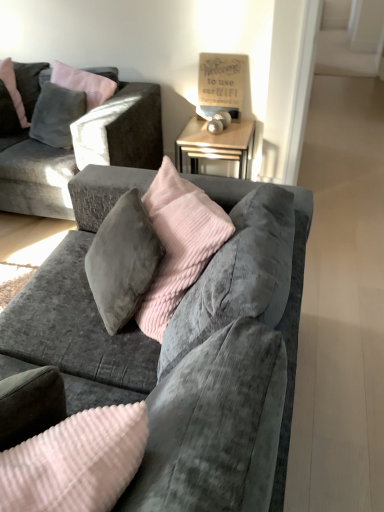
Image resolution: width=384 pixels, height=512 pixels. What do you see at coordinates (78, 146) in the screenshot? I see `velvet gray couch at upper left, which is the 1th studio couch in back-to-front order` at bounding box center [78, 146].

What do you see at coordinates (94, 364) in the screenshot?
I see `velvet gray couch at center, which is counted as the second studio couch, starting from the back` at bounding box center [94, 364].

At what (x,y) coordinates should I click in order to perform the action: click on matte gray pillow at upper left. Please return your answer as a coordinate pair (x, y). Looking at the image, I should click on (13, 89).

From their relative heights in the image, would you say matte gray pillow at upper left is taller or shorter than velvet gray couch at upper left, which ranks as the second studio couch in front-to-back order?

In the image, matte gray pillow at upper left appears to be shorter than velvet gray couch at upper left, which ranks as the second studio couch in front-to-back order.

From a real-world perspective, is matte gray pillow at upper left located beneath velvet gray couch at upper left, which is the 1th studio couch in back-to-front order?

No.

Which object is positioned more to the left, matte gray pillow at upper left or velvet gray couch at upper left, positioned as the 2th studio couch in bottom-to-top order?

From the viewer's perspective, matte gray pillow at upper left appears more on the left side.

Between matte gray pillow at upper left and velvet gray couch at upper left, the 1th studio couch from the top, which one is positioned behind?

matte gray pillow at upper left.

Between velvet gray couch at center, which is counted as the second studio couch, starting from the back, and matte gray pillow at upper left, which one is positioned behind?

matte gray pillow at upper left is further from the camera.

Considering the points (274, 507) and (12, 95), which point is behind, point (274, 507) or point (12, 95)?

The point (12, 95) is farther.

From a real-world perspective, starting from the matte gray pillow at upper left, which studio couch is the 2nd one below it? Please provide its 2D coordinates.

[(94, 364)]

Considering the relative sizes of velvet gray couch at center, placed as the first studio couch when sorted from bottom to top, and matte gray pillow at upper left in the image provided, is velvet gray couch at center, placed as the first studio couch when sorted from bottom to top, taller than matte gray pillow at upper left?

Yes.

Does point (114, 111) come behind point (14, 106)?

No, it is not.

Could matte gray pillow at upper left be considered to be inside velvet gray couch at upper left, the 1th studio couch from the top?

Yes, matte gray pillow at upper left is surrounded by velvet gray couch at upper left, the 1th studio couch from the top.

Who is taller, velvet gray couch at upper left, positioned as the 2th studio couch in bottom-to-top order, or matte gray pillow at upper left?

velvet gray couch at upper left, positioned as the 2th studio couch in bottom-to-top order.

From a real-world perspective, is velvet gray couch at upper left, which is the 1th studio couch in back-to-front order, positioned under velvet gray couch at center, which is counted as the second studio couch, starting from the back, based on gravity?

No, from a real-world perspective, velvet gray couch at upper left, which is the 1th studio couch in back-to-front order, is not below velvet gray couch at center, which is counted as the second studio couch, starting from the back.

Is velvet gray couch at upper left, which ranks as the second studio couch in front-to-back order, completely or partially outside of velvet gray couch at center, the 2th studio couch from the top?

velvet gray couch at upper left, which ranks as the second studio couch in front-to-back order, lies outside velvet gray couch at center, the 2th studio couch from the top,'s area.

Could you tell me if velvet gray couch at upper left, which is the 1th studio couch in back-to-front order, is facing velvet gray couch at center, which is counted as the second studio couch, starting from the back?

No.

Which of these two, velvet gray couch at upper left, the 1th studio couch from the top, or velvet gray couch at center, the 2th studio couch from the top, is thinner?

velvet gray couch at upper left, the 1th studio couch from the top, is thinner.

Is velvet gray couch at center, the 2th studio couch from the top, positioned with its back to velvet gray couch at upper left, the 1th studio couch from the top?

That's not correct — velvet gray couch at center, the 2th studio couch from the top, is not looking away from velvet gray couch at upper left, the 1th studio couch from the top.

How much distance is there between velvet gray couch at center, the 2th studio couch from the top, and velvet gray couch at upper left, the 1th studio couch from the top?

A distance of 37.45 inches exists between velvet gray couch at center, the 2th studio couch from the top, and velvet gray couch at upper left, the 1th studio couch from the top.

From the image's perspective, is velvet gray couch at center, which appears as the first studio couch when viewed from the front, above or below velvet gray couch at upper left, which is the 1th studio couch in back-to-front order?

velvet gray couch at center, which appears as the first studio couch when viewed from the front, is situated lower than velvet gray couch at upper left, which is the 1th studio couch in back-to-front order, in the image.

From their relative heights in the image, would you say velvet gray couch at center, which is counted as the second studio couch, starting from the back, is taller or shorter than velvet gray couch at upper left, which is the 1th studio couch in back-to-front order?

In the image, velvet gray couch at center, which is counted as the second studio couch, starting from the back, appears to be shorter than velvet gray couch at upper left, which is the 1th studio couch in back-to-front order.

Based on their sizes in the image, would you say matte gray pillow at upper left is bigger or smaller than velvet gray couch at center, which is counted as the second studio couch, starting from the back?

matte gray pillow at upper left is smaller than velvet gray couch at center, which is counted as the second studio couch, starting from the back.

Can you confirm if matte gray pillow at upper left is taller than velvet gray couch at center, the 2th studio couch from the top?

Incorrect, the height of matte gray pillow at upper left is not larger of that of velvet gray couch at center, the 2th studio couch from the top.

Considering the relative sizes of matte gray pillow at upper left and velvet gray couch at center, placed as the first studio couch when sorted from bottom to top, in the image provided, is matte gray pillow at upper left wider than velvet gray couch at center, placed as the first studio couch when sorted from bottom to top,?

No, matte gray pillow at upper left is not wider than velvet gray couch at center, placed as the first studio couch when sorted from bottom to top.

Does matte gray pillow at upper left contain velvet gray couch at center, which is counted as the second studio couch, starting from the back?

No, velvet gray couch at center, which is counted as the second studio couch, starting from the back, is not surrounded by matte gray pillow at upper left.

Which studio couch is the 1st one when counting from the right side of the matte gray pillow at upper left? Please provide its 2D coordinates.

[(78, 146)]

At what (x,y) coordinates should I click in order to perform the action: click on pillow behind the velvet gray couch at center, which appears as the first studio couch when viewed from the front. Please return your answer as a coordinate pair (x, y). The width and height of the screenshot is (384, 512). Looking at the image, I should click on (13, 89).

Which object lies further to the anchor point matte gray pillow at upper left, velvet gray couch at upper left, which is the 1th studio couch in back-to-front order, or velvet gray couch at center, which is counted as the second studio couch, starting from the back?

→ velvet gray couch at center, which is counted as the second studio couch, starting from the back, is positioned further to the anchor matte gray pillow at upper left.

Considering their positions, is matte gray pillow at upper left positioned closer to velvet gray couch at center, which appears as the first studio couch when viewed from the front, than velvet gray couch at upper left, which is the 1th studio couch in back-to-front order?

velvet gray couch at upper left, which is the 1th studio couch in back-to-front order, is closer to velvet gray couch at center, which appears as the first studio couch when viewed from the front.

Considering their positions, is matte gray pillow at upper left positioned further to velvet gray couch at upper left, which is the 1th studio couch in back-to-front order, than velvet gray couch at center, the 2th studio couch from the top?

Based on the image, velvet gray couch at center, the 2th studio couch from the top, appears to be further to velvet gray couch at upper left, which is the 1th studio couch in back-to-front order.

Considering their positions, is velvet gray couch at center, which appears as the first studio couch when viewed from the front, positioned further to matte gray pillow at upper left than velvet gray couch at upper left, which is the 1th studio couch in back-to-front order?

Among the two, velvet gray couch at center, which appears as the first studio couch when viewed from the front, is located further to matte gray pillow at upper left.

Looking at the image, which one is located further to velvet gray couch at upper left, which ranks as the second studio couch in front-to-back order, velvet gray couch at center, the 2th studio couch from the top, or matte gray pillow at upper left?

velvet gray couch at center, the 2th studio couch from the top, lies further to velvet gray couch at upper left, which ranks as the second studio couch in front-to-back order, than the other object.

When comparing their distances from velvet gray couch at center, which is counted as the second studio couch, starting from the back, does velvet gray couch at upper left, the 1th studio couch from the top, or matte gray pillow at upper left seem closer?

Among the two, velvet gray couch at upper left, the 1th studio couch from the top, is located nearer to velvet gray couch at center, which is counted as the second studio couch, starting from the back.

This screenshot has width=384, height=512. I want to click on studio couch between velvet gray couch at center, which is counted as the second studio couch, starting from the back, and matte gray pillow at upper left, along the z-axis, so click(x=78, y=146).